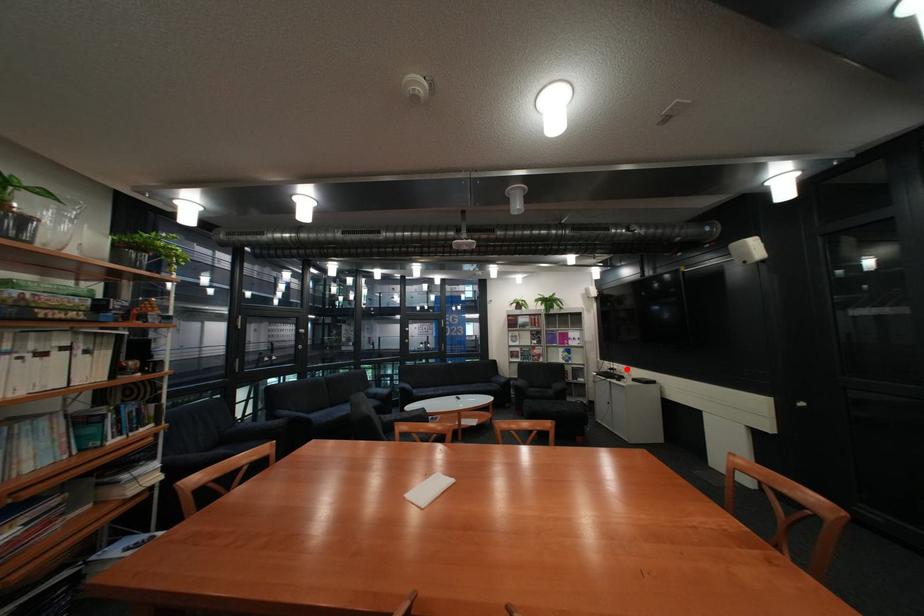
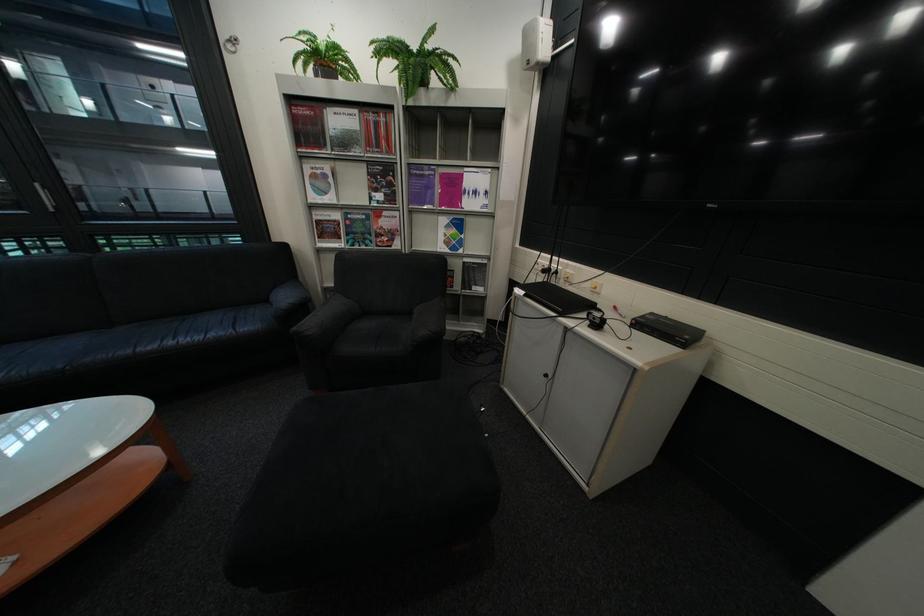
Question: I am providing you with two images of the same scene from different viewpoints. A red point is shown in image1. For the corresponding object point in image2, is it positioned nearer or farther from the camera?

Choices:
 (A) Nearer
 (B) Farther

Answer: (A)